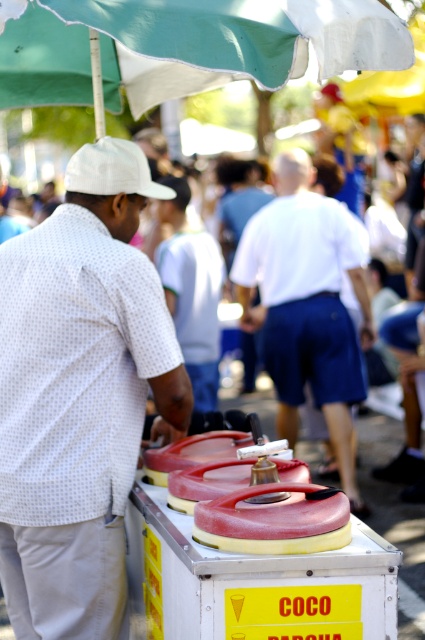
Question: Does white dotted shirt at left appear on the left side of white matte baseball cap at left?

Choices:
 (A) no
 (B) yes

Answer: (B)

Question: Based on their relative distances, which object is farther from the white dotted shirt at left?

Choices:
 (A) white matte baseball cap at left
 (B) white cotton shirt at center

Answer: (B)

Question: Does green fabric umbrella at upper center appear over white matte baseball cap at left?

Choices:
 (A) no
 (B) yes

Answer: (B)

Question: Among these objects, which one is farthest from the camera?

Choices:
 (A) white dotted shirt at left
 (B) green fabric umbrella at upper center
 (C) white cotton shirt at center

Answer: (C)

Question: Can you confirm if green fabric umbrella at upper center is positioned above white matte baseball cap at left?

Choices:
 (A) yes
 (B) no

Answer: (A)

Question: Which of these objects is positioned closest to the white matte baseball cap at left?

Choices:
 (A) green fabric umbrella at upper center
 (B) white dotted shirt at left
 (C) white cotton shirt at center

Answer: (B)